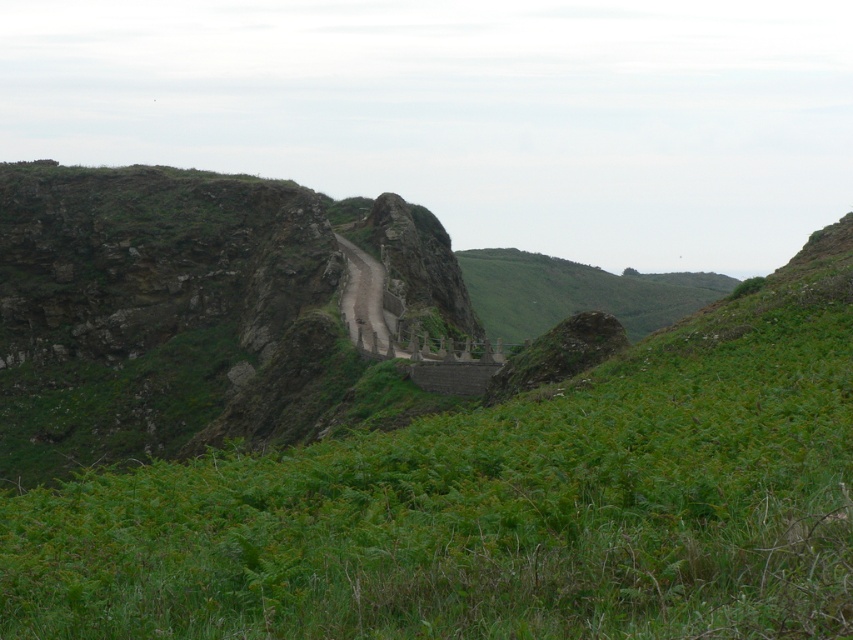
Question: Is green leafy grass at center positioned at the back of dull gray stone at center?

Choices:
 (A) yes
 (B) no

Answer: (B)

Question: Which point appears closest to the camera in this image?

Choices:
 (A) (486, 595)
 (B) (386, 321)

Answer: (A)

Question: Can you confirm if green leafy grass at center is positioned to the left of dull gray stone at center?

Choices:
 (A) yes
 (B) no

Answer: (B)

Question: Can you confirm if green leafy grass at center is smaller than dull gray stone at center?

Choices:
 (A) yes
 (B) no

Answer: (B)